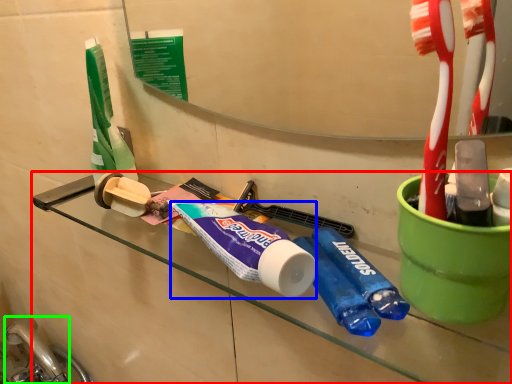
Question: Which object is positioned closest to counter (highlighted by a red box)? Select from toothpaste (highlighted by a blue box) and faucet (highlighted by a green box).

Choices:
 (A) toothpaste
 (B) faucet

Answer: (A)